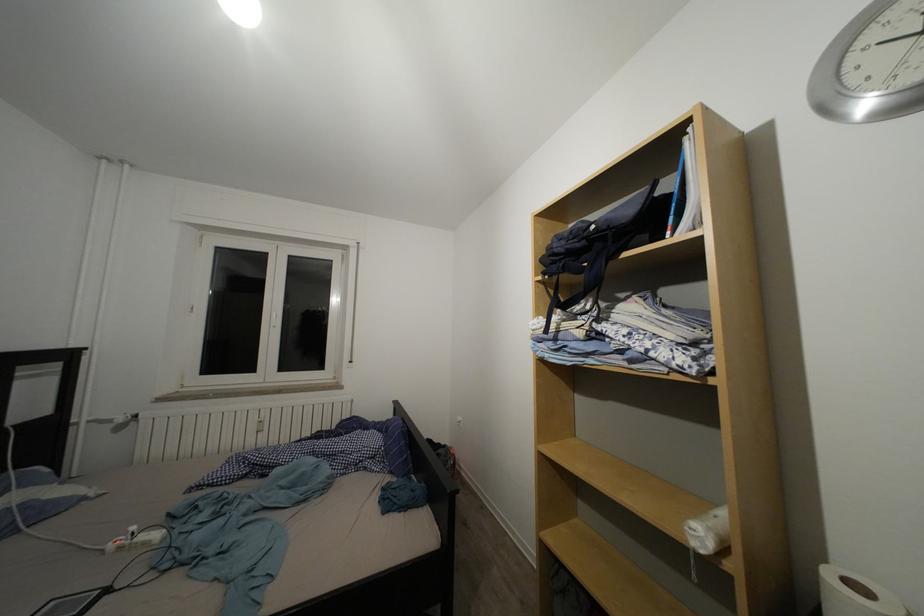
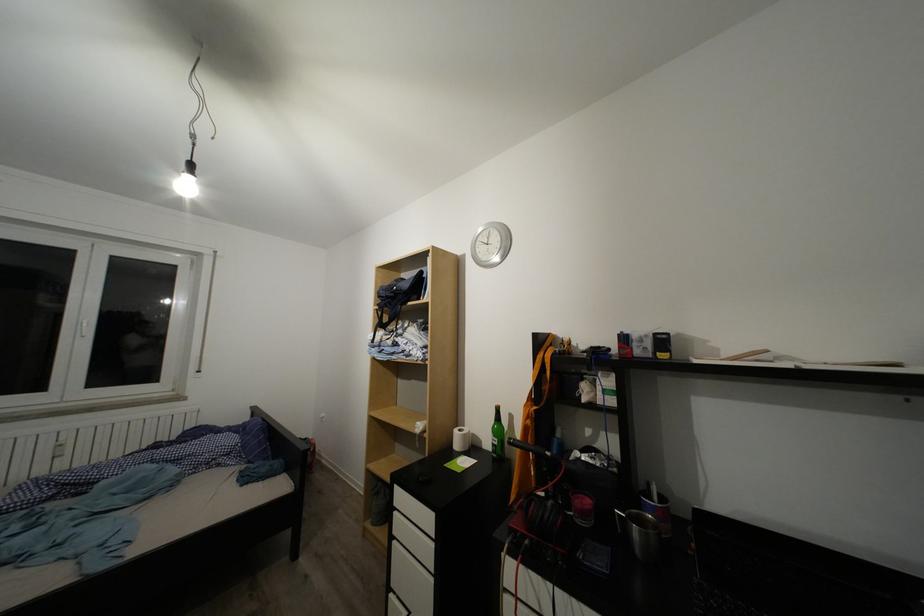
Question: In a continuous first-person perspective shot, in which direction is the camera moving?

Choices:
 (A) Left
 (B) Right
 (C) Forward
 (D) Backward

Answer: (D)